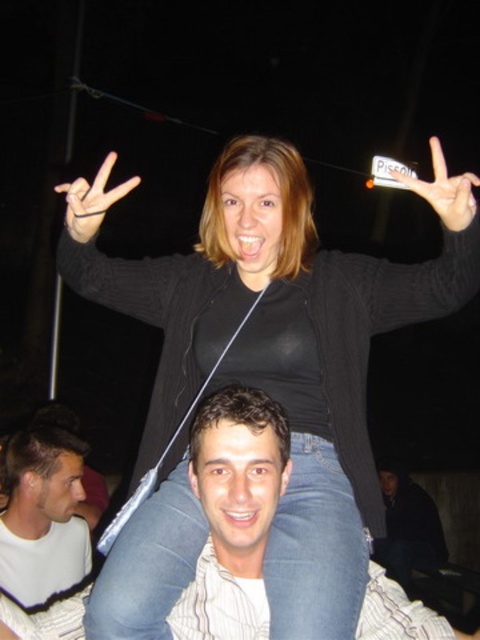
You are at a party and want to take a photo of the black sweater at center and the white matte shirt at lower left. Which one should you focus on first if you want to capture both in the same frame without moving the camera?

The black sweater at center is located above the white matte shirt at lower left, so you should focus on the black sweater at center first to ensure both are in the frame.

You are a photographer trying to capture a candid shot of the white matte shirt at lower left and the black rubber band at upper left. You want to ensure both subjects are in focus without moving your position. Based on their distance apart, is it feasible to have both in focus using a standard camera lens with a depth of field of 5 feet?

The white matte shirt at lower left and black rubber band at upper left are 4.47 feet apart. Since the depth of field is 5 feet, which is greater than the distance between them, it is feasible to have both in focus without moving your position.

You are a photographer trying to capture a clear shot of both the white matte shirt at lower left and the white matte sign at upper center. Since you want to ensure both are visible, which object should you focus on first to account for their sizes?

You should focus on the white matte sign at upper center first because it is wider than the white matte shirt at lower left, making it more prominent in the frame.